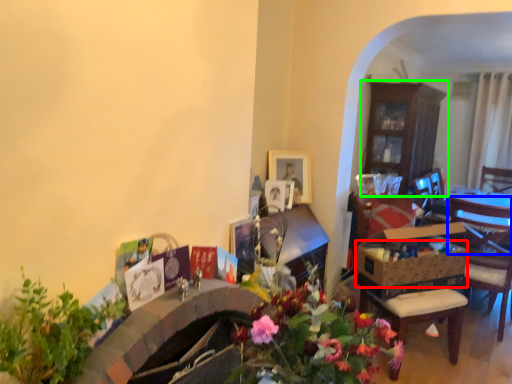
Question: Based on their relative distances, which object is nearer to flower basket (highlighted by a red box)? Choose from chair (highlighted by a blue box) and cabinetry (highlighted by a green box).

Choices:
 (A) chair
 (B) cabinetry

Answer: (A)